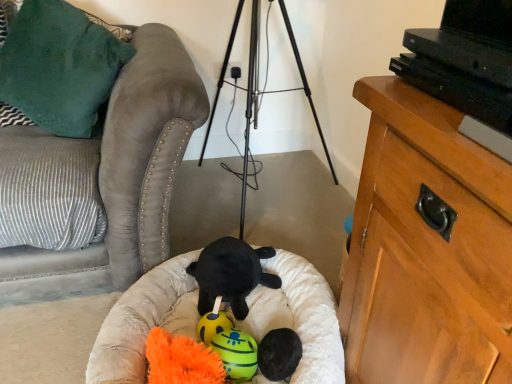
Question: Which direction should I rotate to look at yellow rubber ball at center, positioned as the third toy in back-to-front order?

Choices:
 (A) right
 (B) left

Answer: (B)

Question: From a real-world perspective, is velvety green pillow at upper left physically below white plush dog bed at center?

Choices:
 (A) yes
 (B) no

Answer: (B)

Question: Considering the relative sizes of velvety green pillow at upper left and white plush dog bed at center in the image provided, is velvety green pillow at upper left taller than white plush dog bed at center?

Choices:
 (A) yes
 (B) no

Answer: (A)

Question: Considering the relative sizes of velvety green pillow at upper left and white plush dog bed at center in the image provided, is velvety green pillow at upper left wider than white plush dog bed at center?

Choices:
 (A) yes
 (B) no

Answer: (B)

Question: Can you confirm if velvety green pillow at upper left is shorter than white plush dog bed at center?

Choices:
 (A) yes
 (B) no

Answer: (B)

Question: Is velvety green pillow at upper left bigger than white plush dog bed at center?

Choices:
 (A) yes
 (B) no

Answer: (B)

Question: Is velvety green pillow at upper left positioned before white plush dog bed at center?

Choices:
 (A) yes
 (B) no

Answer: (B)

Question: From a real-world perspective, does suede couch at left sit lower than black plush toy at center, placed as the 3th toy when sorted from front to back?

Choices:
 (A) yes
 (B) no

Answer: (B)

Question: From the image's perspective, is suede couch at left beneath black plush toy at center, placed as the 3th toy when sorted from front to back?

Choices:
 (A) yes
 (B) no

Answer: (B)

Question: Considering the relative sizes of suede couch at left and black plush toy at center, placed as the 3th toy when sorted from front to back, in the image provided, is suede couch at left shorter than black plush toy at center, placed as the 3th toy when sorted from front to back,?

Choices:
 (A) no
 (B) yes

Answer: (A)

Question: Is suede couch at left with black plush toy at center, placed as the 3th toy when sorted from front to back?

Choices:
 (A) no
 (B) yes

Answer: (A)

Question: Does suede couch at left appear on the right side of black plush toy at center, placed as the 3th toy when sorted from front to back?

Choices:
 (A) no
 (B) yes

Answer: (A)

Question: Can you confirm if suede couch at left is bigger than black plush toy at center, marked as the second toy in a back-to-front arrangement?

Choices:
 (A) yes
 (B) no

Answer: (A)

Question: Considering the relative sizes of black plush toy at center, marked as the second toy in a back-to-front arrangement, and white plush dog bed at center in the image provided, is black plush toy at center, marked as the second toy in a back-to-front arrangement, wider than white plush dog bed at center?

Choices:
 (A) no
 (B) yes

Answer: (A)